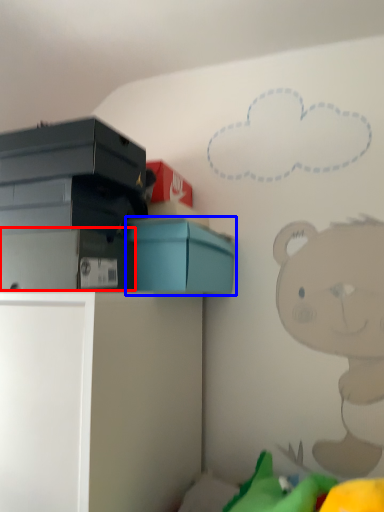
Question: Among these objects, which one is farthest to the camera, storage box (highlighted by a red box) or box (highlighted by a blue box)?

Choices:
 (A) storage box
 (B) box

Answer: (B)